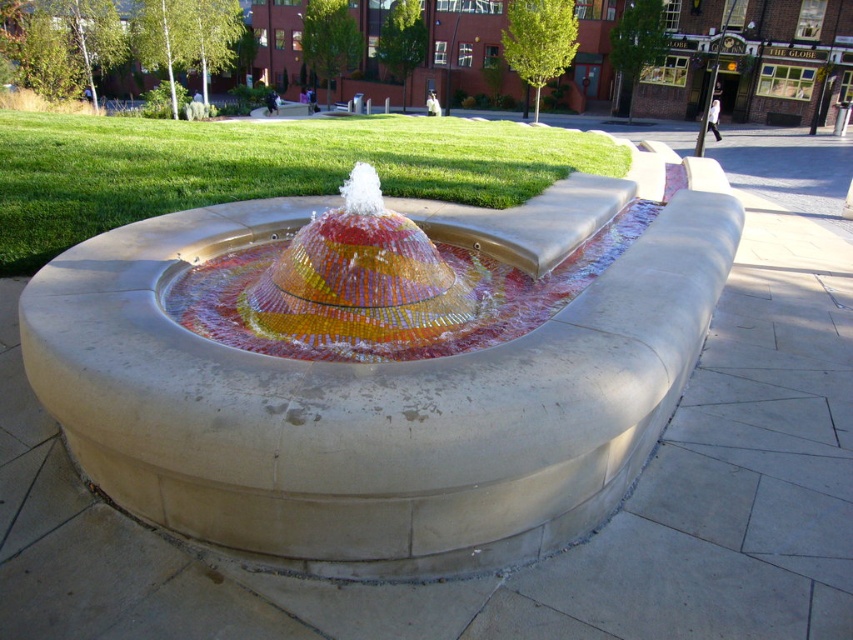
Does mosaic tile fountain at center have a smaller size compared to multicolored mosaic water at center?

No.

Does point (433, 477) lie in front of point (643, 212)?

Yes.

The image size is (853, 640). Find the location of `mosaic tile fountain at center`. mosaic tile fountain at center is located at coordinates (370, 401).